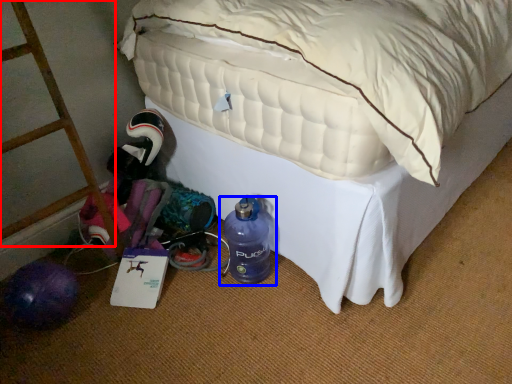
Question: Which of the following is the closest to the observer, ladder (highlighted by a red box) or bottle (highlighted by a blue box)?

Choices:
 (A) ladder
 (B) bottle

Answer: (A)